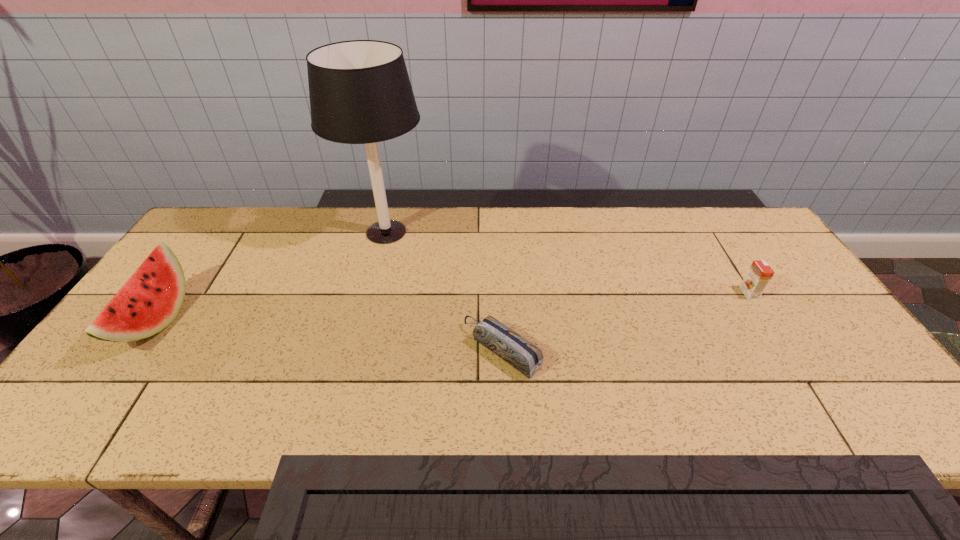
Locate an element on the screen. This screenshot has height=540, width=960. table lamp is located at coordinates (360, 93).

Find the location of a particular element. the tallest object is located at coordinates (360, 93).

This screenshot has width=960, height=540. I want to click on the third shortest object, so click(x=152, y=297).

At what (x,y) coordinates should I click in order to perform the action: click on the leftmost object. Please return your answer as a coordinate pair (x, y). Looking at the image, I should click on (152, 297).

Locate an element on the screen. the third tallest object is located at coordinates (759, 274).

Where is `orange juice`? orange juice is located at coordinates (759, 274).

Find the location of a particular element. The width and height of the screenshot is (960, 540). the third object from left to right is located at coordinates (520, 353).

This screenshot has width=960, height=540. Identify the location of pencil box. (520, 353).

What are the coordinates of `free space located on the front of the table lamp` in the screenshot? It's located at (354, 355).

At what (x,y) coordinates should I click in order to perform the action: click on free location located on the outer rind of the watermelon. Please return your answer as a coordinate pair (x, y). The image size is (960, 540). Looking at the image, I should click on (225, 321).